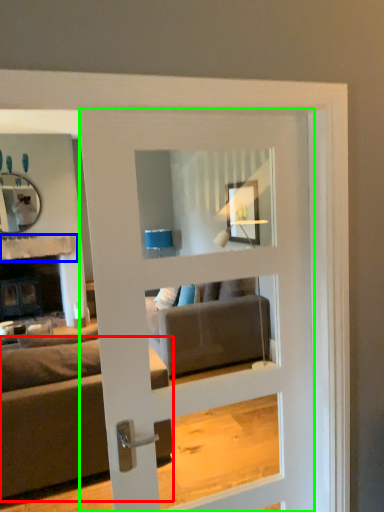
Question: Which object is positioned farthest from studio couch (highlighted by a red box)? Select from balustrade (highlighted by a blue box) and door (highlighted by a green box).

Choices:
 (A) balustrade
 (B) door

Answer: (A)